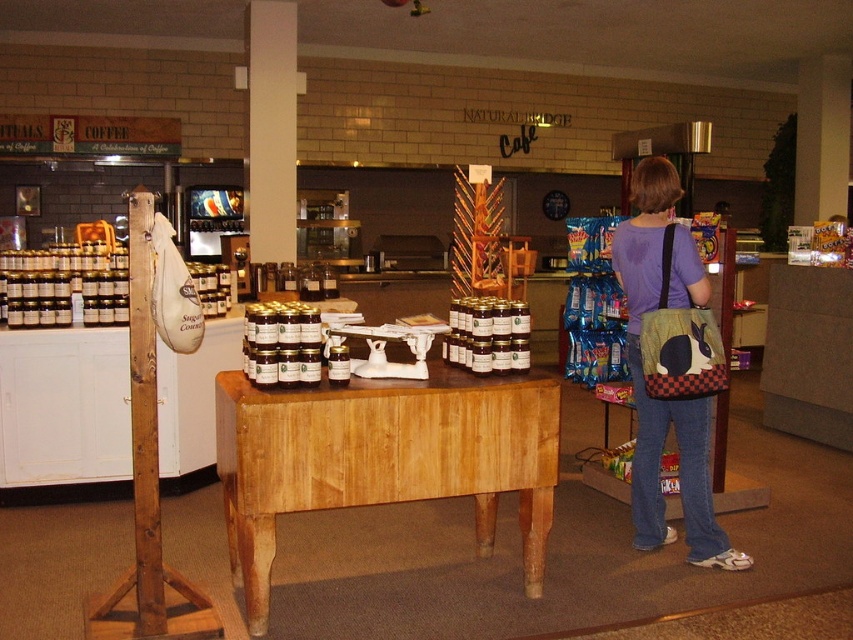
Who is higher up, light brown wood table at center or matte purple shirt at center?

matte purple shirt at center is above.

The height and width of the screenshot is (640, 853). Identify the location of light brown wood table at center. (383, 460).

Find the location of a particular element. The image size is (853, 640). light brown wood table at center is located at coordinates (383, 460).